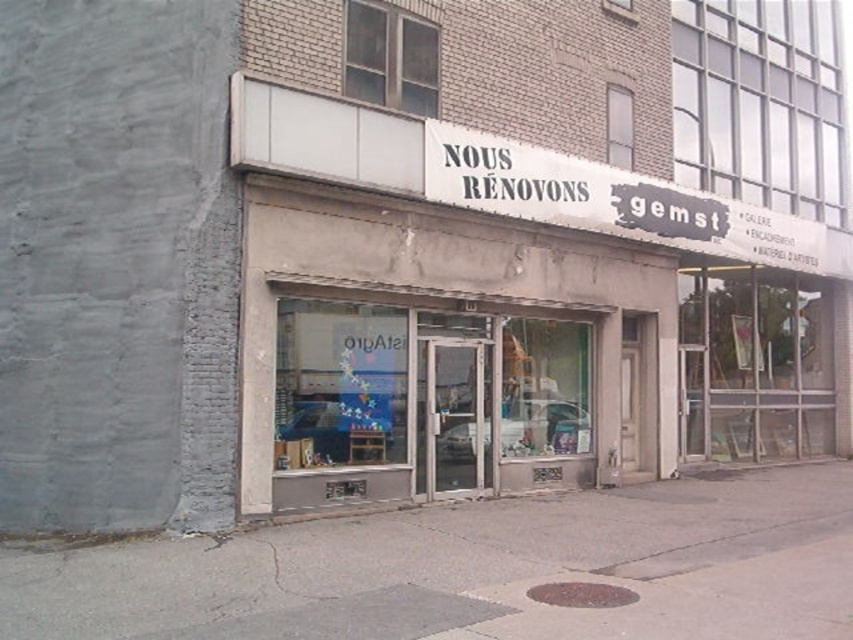
The height and width of the screenshot is (640, 853). What do you see at coordinates (424, 401) in the screenshot?
I see `transparent glass shop window at center` at bounding box center [424, 401].

Is transparent glass shop window at center taller than white paper sign at upper center?

Yes, transparent glass shop window at center is taller than white paper sign at upper center.

Does point (553, 362) lie in front of point (776, 244)?

Yes, point (553, 362) is closer to viewer.

The height and width of the screenshot is (640, 853). I want to click on transparent glass shop window at center, so click(424, 401).